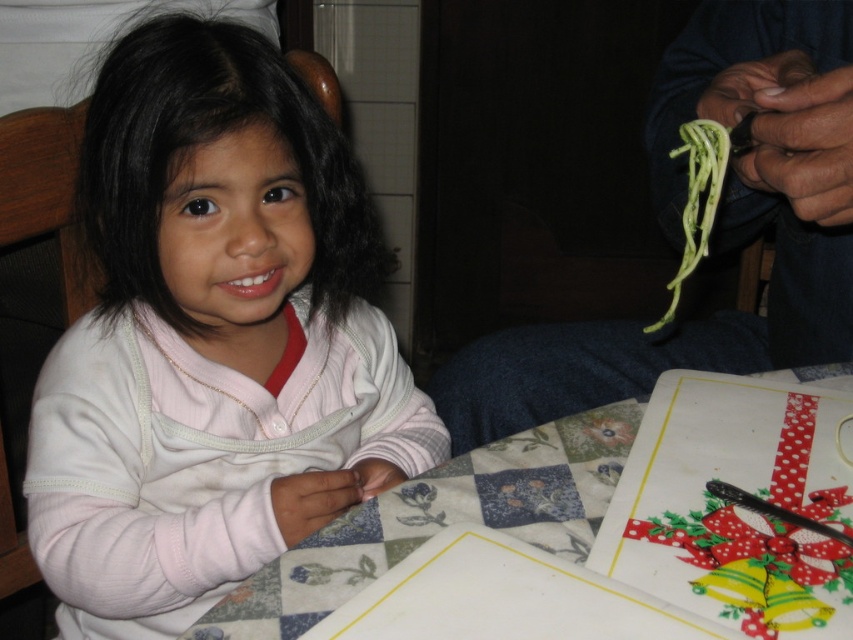
Question: Is white fabric table at center closer to the viewer compared to green matte spaghetti at upper right?

Choices:
 (A) no
 (B) yes

Answer: (B)

Question: Estimate the real-world distances between objects in this image. Which object is closer to the white fabric table at center?

Choices:
 (A) pink fleece sweater at center
 (B) green matte spaghetti at upper right

Answer: (B)

Question: Can you confirm if pink fleece sweater at center is smaller than white fabric table at center?

Choices:
 (A) no
 (B) yes

Answer: (A)

Question: Which point is farther to the camera?

Choices:
 (A) (283, 621)
 (B) (726, 161)
 (C) (253, 42)

Answer: (C)

Question: Is pink fleece sweater at center wider than white fabric table at center?

Choices:
 (A) no
 (B) yes

Answer: (A)

Question: Which object is positioned farthest from the white fabric table at center?

Choices:
 (A) green matte spaghetti at upper right
 (B) pink fleece sweater at center

Answer: (B)